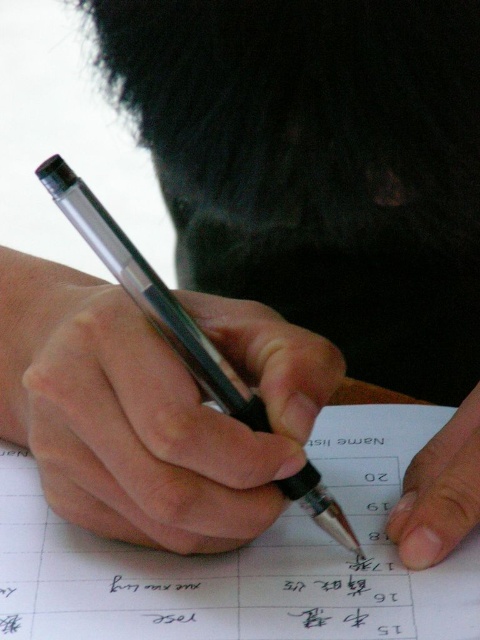
Can you confirm if metallic pen at center is bigger than white paper at center?

No, metallic pen at center is not bigger than white paper at center.

Does metallic pen at center appear over white paper at center?

Yes.

Locate an element on the screen. The image size is (480, 640). metallic pen at center is located at coordinates (173, 419).

At what (x,y) coordinates should I click in order to perform the action: click on metallic pen at center. Please return your answer as a coordinate pair (x, y). Looking at the image, I should click on (173, 419).

You are a GUI agent. You are given a task and a screenshot of the screen. Output one action in this format:
    pyautogui.click(x=<x>, y=<y>)
    Task: Click on the metallic pen at center
    
    Given the screenshot: What is the action you would take?
    pyautogui.click(x=173, y=419)

Which of these two, metallic pen at center or flesh-toned skin at lower right, stands shorter?

flesh-toned skin at lower right is shorter.

Between point (215, 422) and point (470, 508), which one is positioned in front?

Point (215, 422) is more forward.

Locate an element on the screen. This screenshot has height=640, width=480. metallic pen at center is located at coordinates (173, 419).

Based on the photo, which is below, white paper at center or flesh-toned skin at lower right?

Positioned lower is white paper at center.

Does white paper at center come behind flesh-toned skin at lower right?

That is False.

Locate an element on the screen. This screenshot has width=480, height=640. white paper at center is located at coordinates (244, 560).

Identify the location of white paper at center. (244, 560).